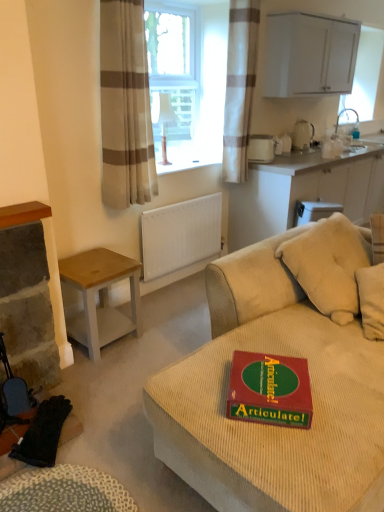
Locate an element on the screen. Image resolution: width=384 pixels, height=512 pixels. vacant point above green cardboard game at center (from a real-world perspective) is located at coordinates (272, 378).